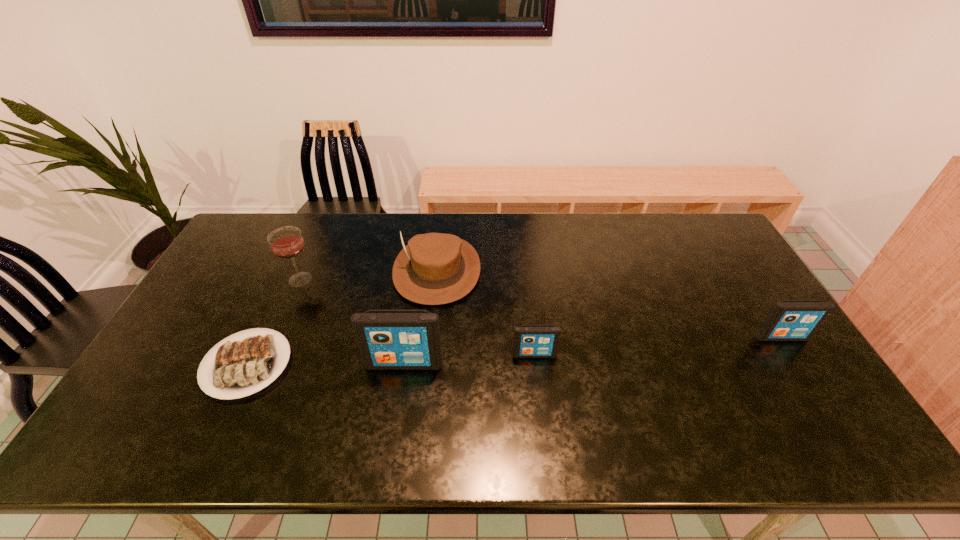
The image size is (960, 540). Find the location of `location for an additional iPod to make spacing equal`. location for an additional iPod to make spacing equal is located at coordinates (660, 346).